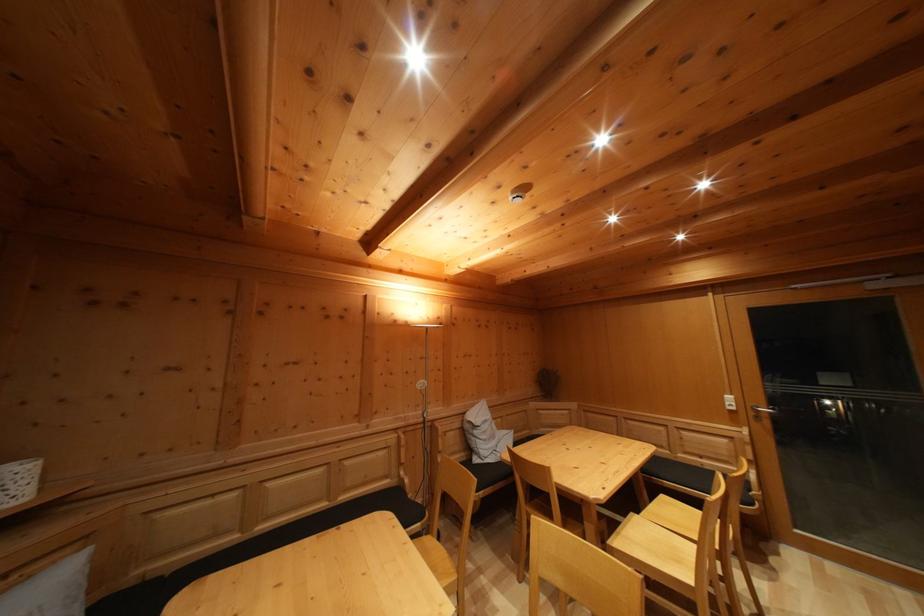
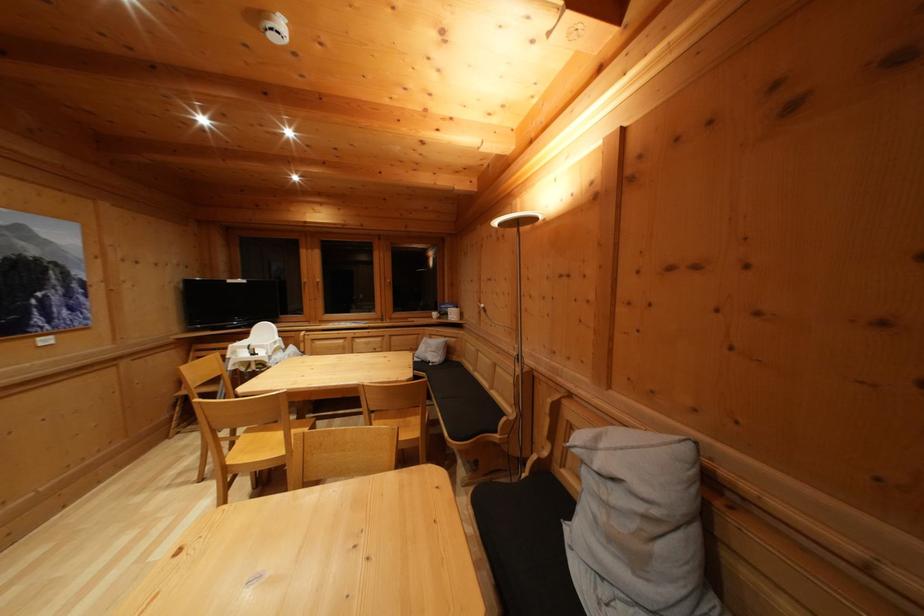
Find the pixel in the second image that matches (499,444) in the first image.

(640, 565)